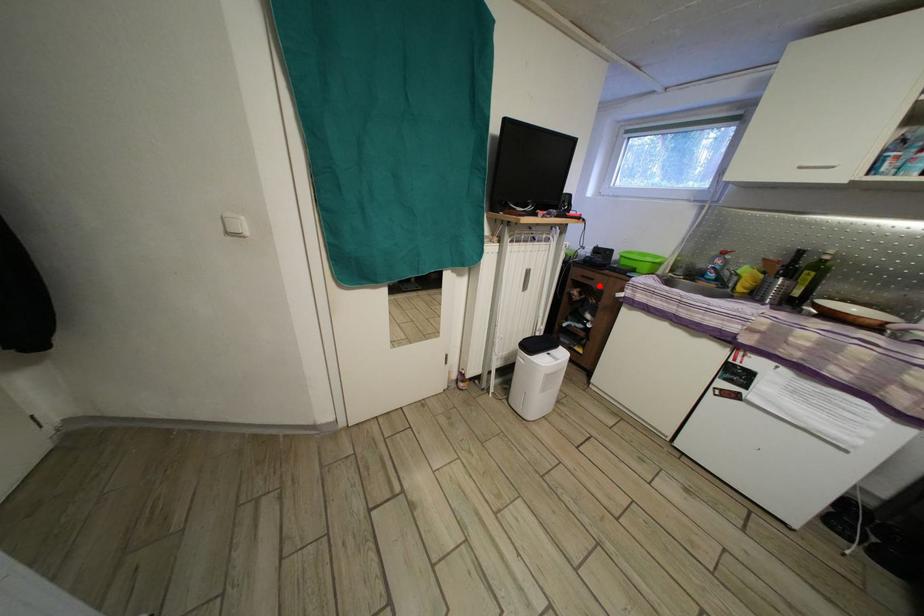
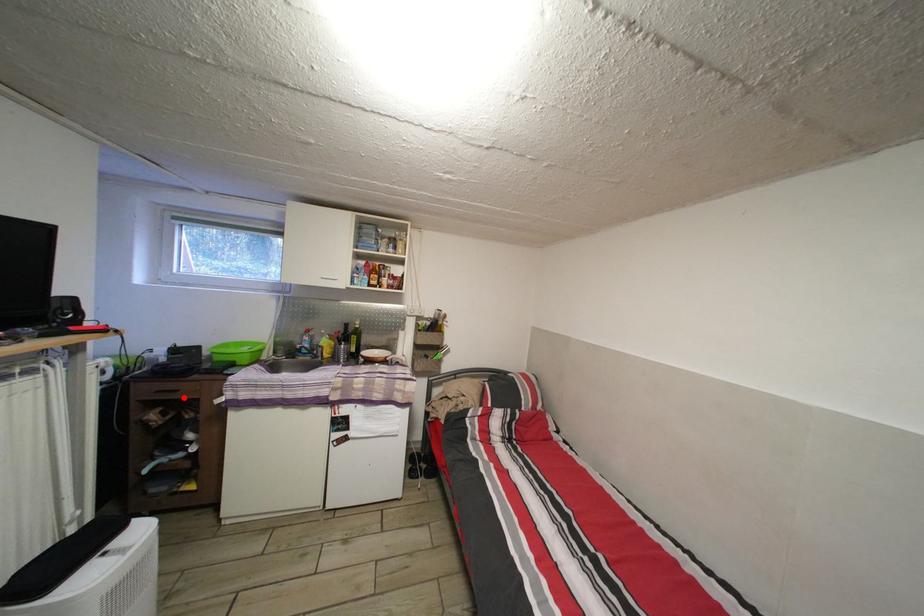
I am providing you with two images of the same scene from different viewpoints. A red point is marked on the first image and another point is marked on the second image. Is the marked point in image1 the same physical position as the marked point in image2?

Yes